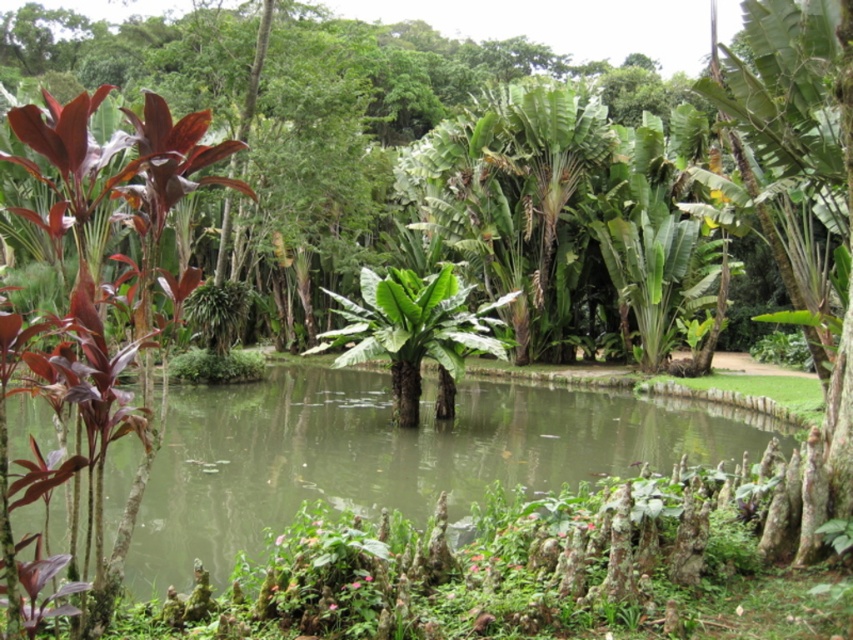
Does point (228, 518) come farther from viewer compared to point (160, 109)?

Yes, it is behind point (160, 109).

Who is more forward, (364, 440) or (27, 118)?

Point (27, 118) is more forward.

The width and height of the screenshot is (853, 640). In order to click on green murky water at center in this screenshot , I will do (x=393, y=454).